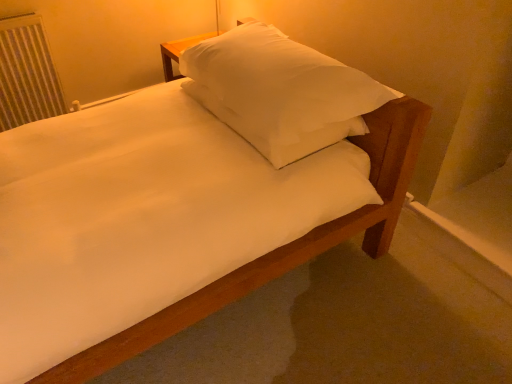
Question: Based on their sizes in the image, would you say white painted metal radiator at left is bigger or smaller than white soft pillow at upper center?

Choices:
 (A) big
 (B) small

Answer: (B)

Question: From the image's perspective, is white painted metal radiator at left located above or below white soft pillow at upper center?

Choices:
 (A) below
 (B) above

Answer: (B)

Question: Considering the positions of white painted metal radiator at left and white soft pillow at upper center in the image, is white painted metal radiator at left wider or thinner than white soft pillow at upper center?

Choices:
 (A) thin
 (B) wide

Answer: (A)

Question: Relative to white painted metal radiator at left, is white soft pillow at upper center in front or behind?

Choices:
 (A) front
 (B) behind

Answer: (A)

Question: Is white soft pillow at upper center bigger or smaller than white painted metal radiator at left?

Choices:
 (A) big
 (B) small

Answer: (A)

Question: In terms of width, does white soft pillow at upper center look wider or thinner when compared to white painted metal radiator at left?

Choices:
 (A) wide
 (B) thin

Answer: (A)

Question: From the image's perspective, is white soft pillow at upper center positioned above or below white painted metal radiator at left?

Choices:
 (A) below
 (B) above

Answer: (A)